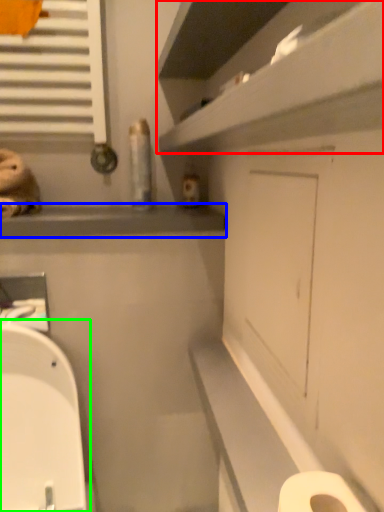
Question: Considering the real-world distances, which object is farthest from shelf (highlighted by a red box)? window sill (highlighted by a blue box) or toilet (highlighted by a green box)?

Choices:
 (A) window sill
 (B) toilet

Answer: (B)